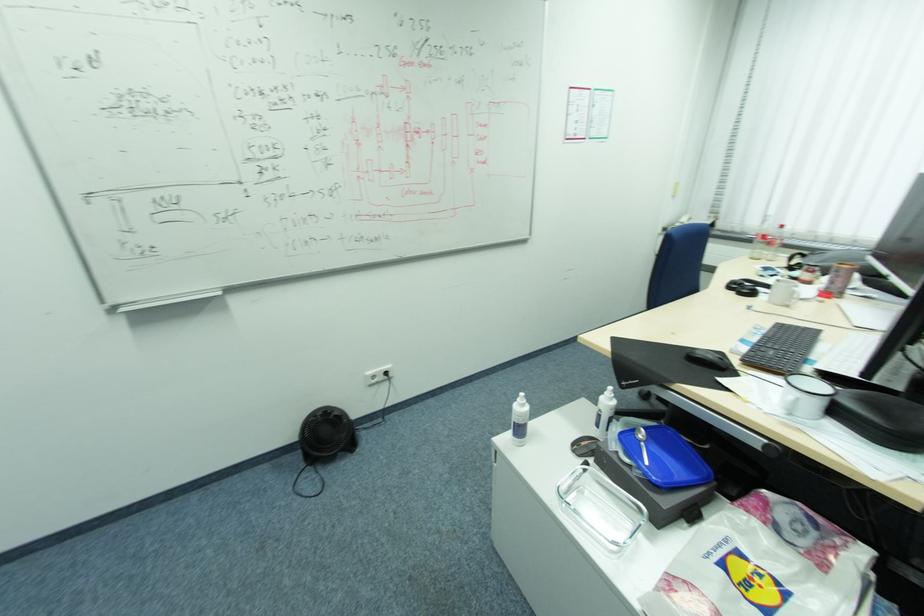
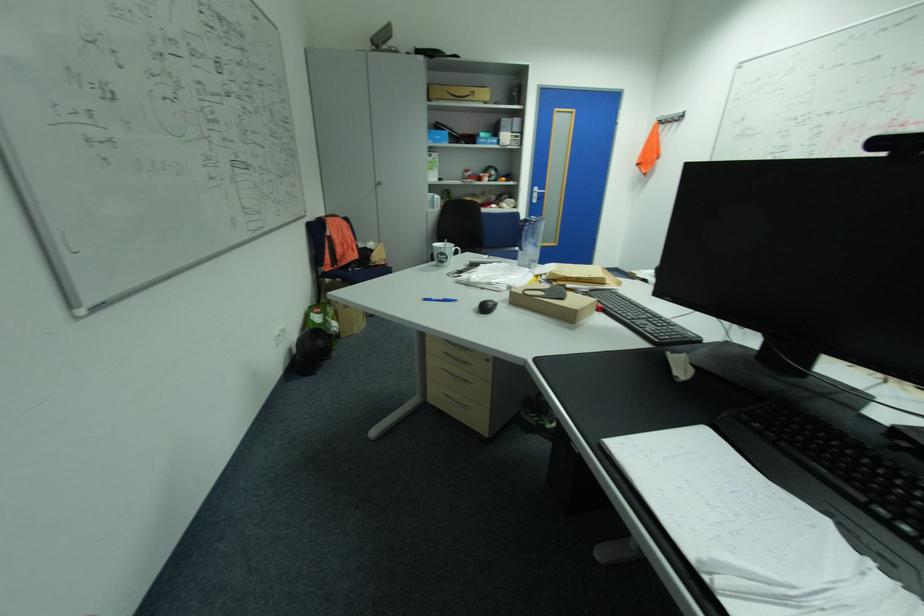
Question: I am providing you with two images of the same scene from different viewpoints. Please identify which objects are invisible in image2.

Choices:
 (A) orange screwdriver
 (B) white mug handle
 (C) blue pen
 (D) printed white mug

Answer: (B)